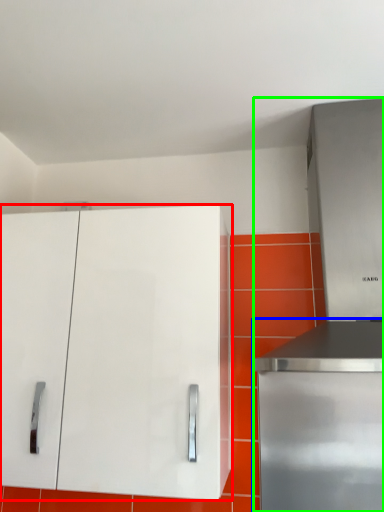
Question: Which object is positioned farthest from cabinetry (highlighted by a red box)? Select from home appliance (highlighted by a blue box) and appliance (highlighted by a green box).

Choices:
 (A) home appliance
 (B) appliance

Answer: (A)